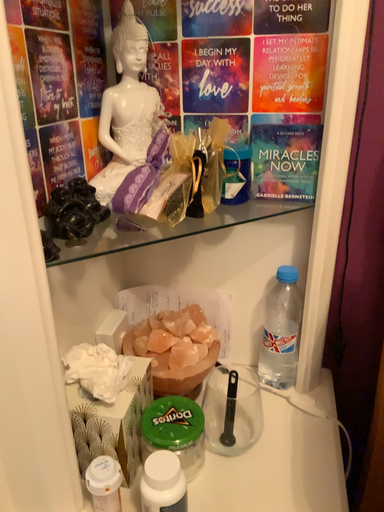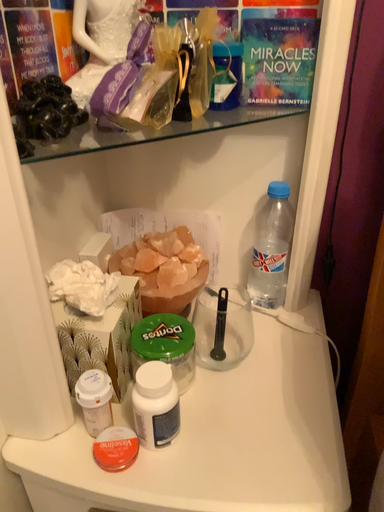
Question: How did the camera likely rotate when shooting the video?

Choices:
 (A) rotated downward
 (B) rotated upward

Answer: (A)